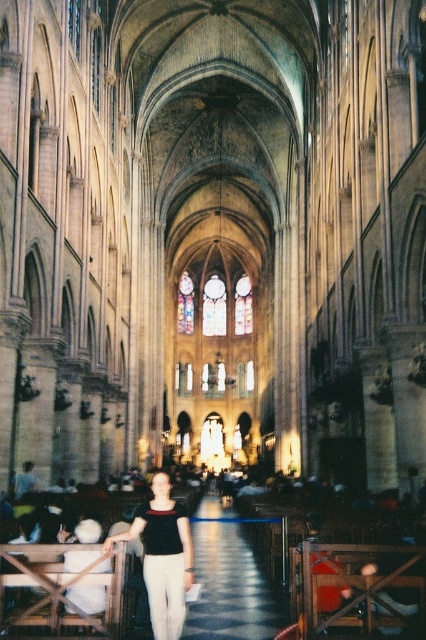
You are standing in the cathedral and notice the polished stone aisle at center and the matte black blouse at center. Which object is higher in height?

The polished stone aisle at center is taller than the matte black blouse at center.

You are standing in the cathedral and notice a polished stone aisle at center and a matte black blouse at center. Which object is located to the right of the other?

The polished stone aisle at center is positioned on the right side of matte black blouse at center.

You are standing in the cathedral and want to move from point A to point B. Point A is at coordinates point (204,564), and point B is at coordinates point (158,506). Which point is closer to the entrance of the cathedral?

Point (158,506) is closer to the entrance because point (204,564) is behind it.